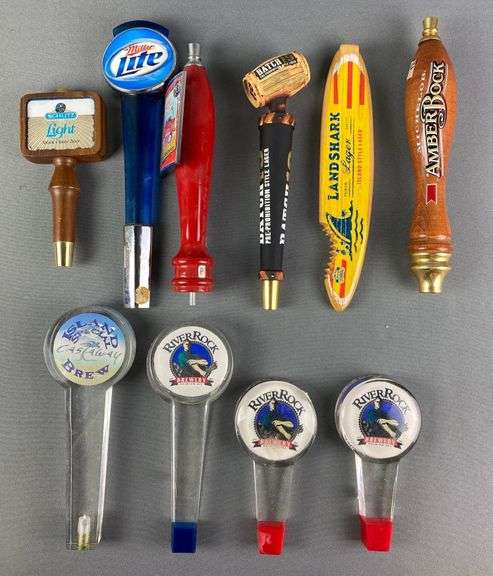
Find the location of `bottom row tap handles`. bottom row tap handles is located at coordinates (93, 452), (188, 444), (278, 482), (371, 468).